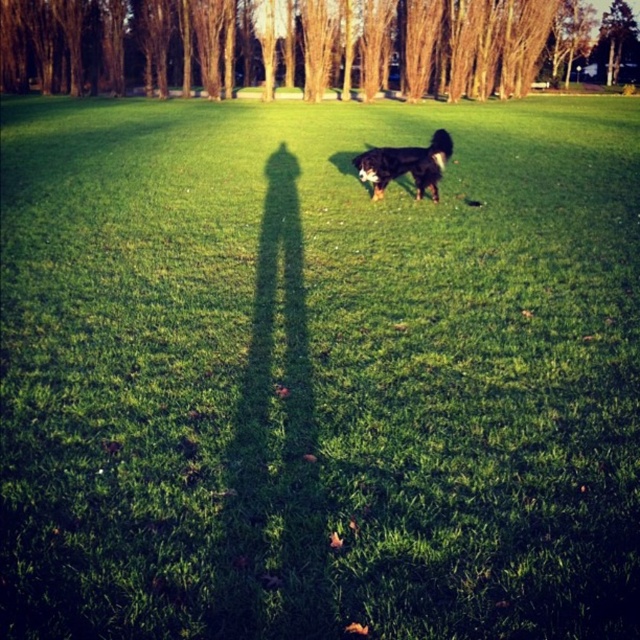
Question: Is brown bark tree at center closer to camera compared to black shaggy dog at center?

Choices:
 (A) yes
 (B) no

Answer: (B)

Question: Which object appears closest to the camera in this image?

Choices:
 (A) black shaggy dog at center
 (B) brown bark tree at center

Answer: (A)

Question: Observing the image, what is the correct spatial positioning of brown bark tree at center in reference to black shaggy dog at center?

Choices:
 (A) right
 (B) left

Answer: (A)

Question: Does brown bark tree at center come behind black shaggy dog at center?

Choices:
 (A) yes
 (B) no

Answer: (A)

Question: Among these objects, which one is farthest from the camera?

Choices:
 (A) brown bark tree at center
 (B) black shaggy dog at center

Answer: (A)